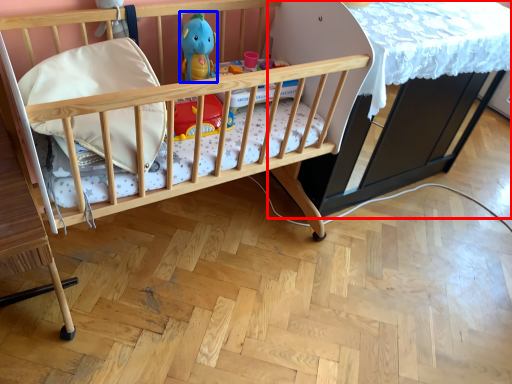
Question: Which point is further to the camera, table (highlighted by a red box) or toy (highlighted by a blue box)?

Choices:
 (A) table
 (B) toy

Answer: (B)